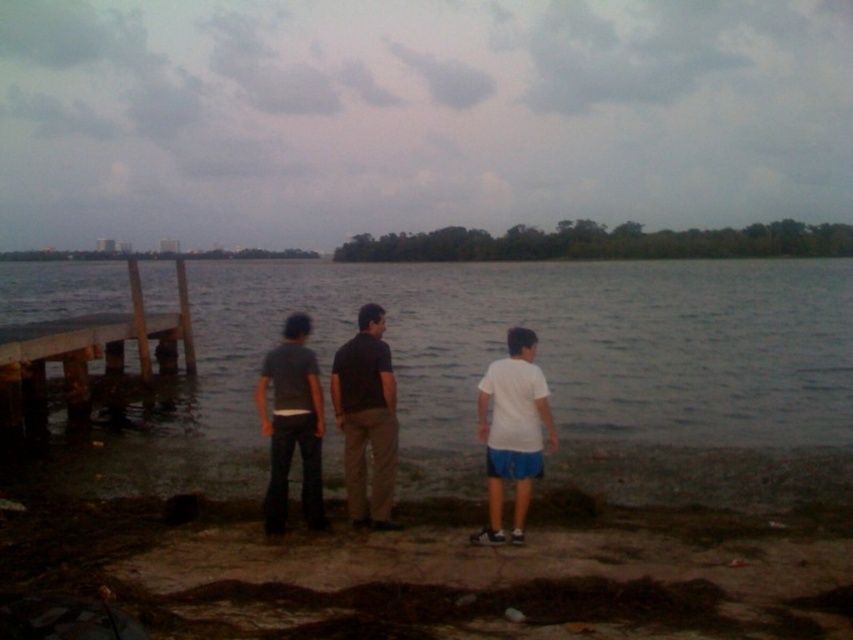
Question: Does dark brown cotton pants at center have a larger size compared to white matte shirt at center?

Choices:
 (A) yes
 (B) no

Answer: (B)

Question: Among these points, which one is nearest to the camera?

Choices:
 (A) [276, 376]
 (B) [508, 477]
 (C) [10, 416]
 (D) [383, 472]

Answer: (B)

Question: Can you confirm if brown wooden dock at left is positioned above white matte shirt at center?

Choices:
 (A) yes
 (B) no

Answer: (A)

Question: Which object appears farthest from the camera in this image?

Choices:
 (A) brown dirt at lower center
 (B) dark gray cotton shirt at center
 (C) dark brown cotton pants at center
 (D) white matte shirt at center

Answer: (C)

Question: Is dark brown cotton pants at center thinner than dark gray jeans at center?

Choices:
 (A) yes
 (B) no

Answer: (A)

Question: Which of these objects is positioned closest to the dark gray jeans at center?

Choices:
 (A) brown wooden dock at left
 (B) dark gray cotton shirt at center
 (C) dark brown cotton pants at center

Answer: (B)